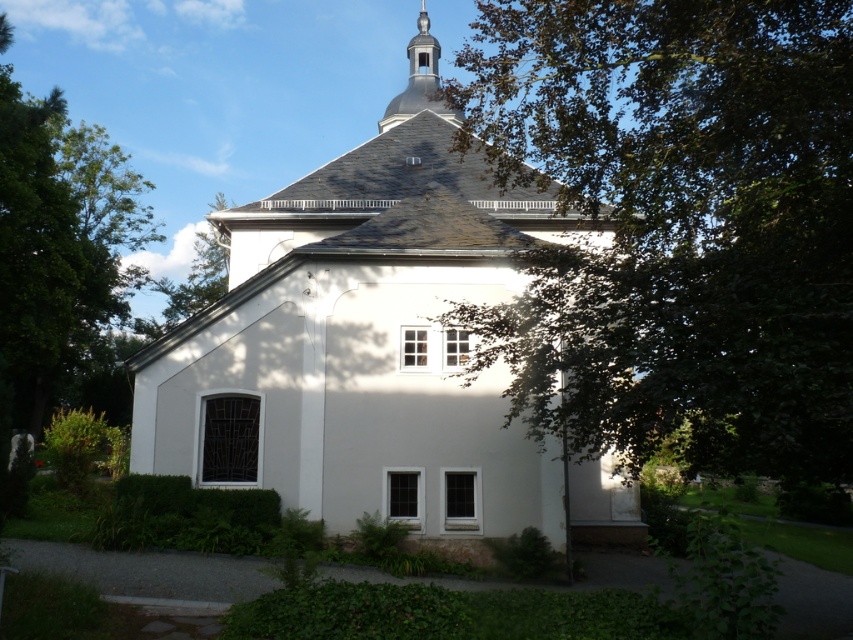
You are standing in front of the white building with a steep roof and a small dark dome. You notice two points marked on the building. The first point is at coordinates point (712, 241) and the second point is at point (126, 218). Which of these two points is closer to you as you face the building?

Point (712, 241) is in front of point (126, 218), so the first point is closer to you.

You are standing in front of the white building with the steep roof. There is a point marked at coordinates [679,228]. What object is located at that point?

The point at coordinates [679,228] is occupied by a green leafy tree at center.